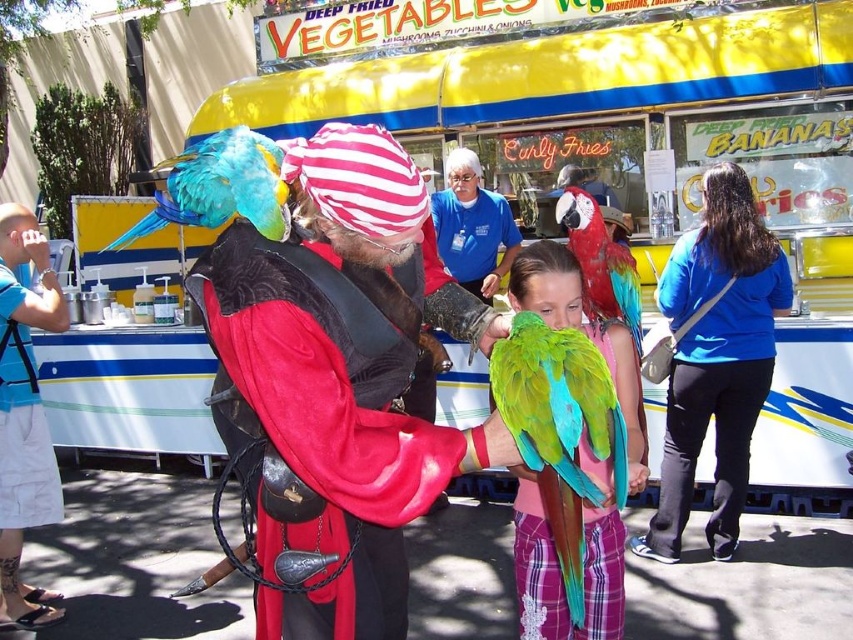
Image resolution: width=853 pixels, height=640 pixels. What do you see at coordinates (340, 381) in the screenshot?
I see `velvet pirate costume at center` at bounding box center [340, 381].

Identify the location of velvet pirate costume at center. (340, 381).

Where is `velvet pirate costume at center`? Image resolution: width=853 pixels, height=640 pixels. velvet pirate costume at center is located at coordinates (340, 381).

Who is positioned more to the right, velvet pirate costume at center or blue fabric shirt at center?

From the viewer's perspective, blue fabric shirt at center appears more on the right side.

Between velvet pirate costume at center and blue fabric shirt at center, which one is positioned higher?

velvet pirate costume at center

The height and width of the screenshot is (640, 853). Identify the location of velvet pirate costume at center. (340, 381).

Can you confirm if yellow fabric food truck at center is thinner than blue fabric shirt at center?

No.

In the scene shown: Is yellow fabric food truck at center further to camera compared to blue fabric shirt at center?

Yes, it is.

Does point (770, 132) lie in front of point (660, 468)?

No.

This screenshot has height=640, width=853. Identify the location of yellow fabric food truck at center. (642, 161).